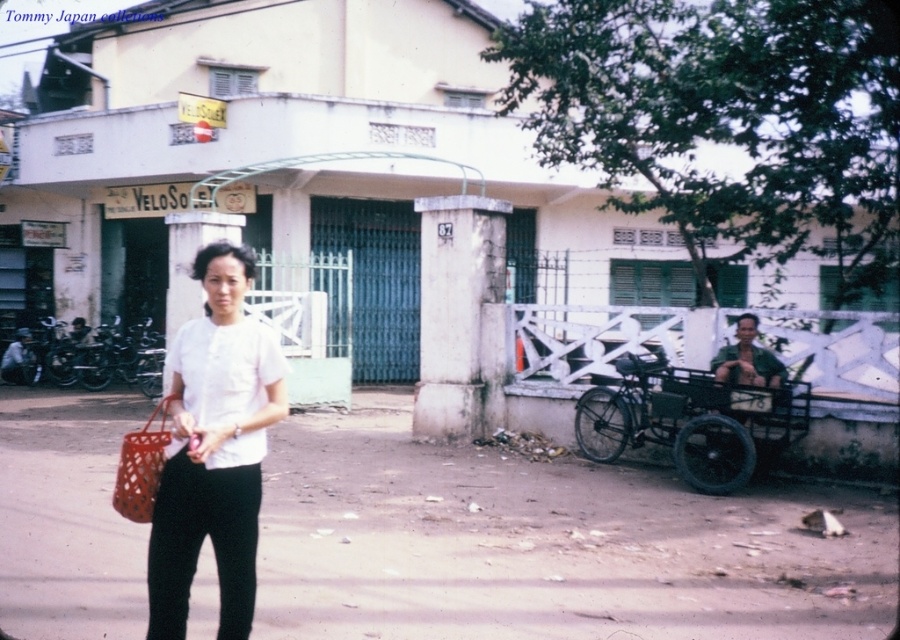
Question: Is brown dirt pavement at center to the left of black metal cart at right from the viewer's perspective?

Choices:
 (A) yes
 (B) no

Answer: (A)

Question: Which object is farther from the camera taking this photo?

Choices:
 (A) brown dirt pavement at center
 (B) white matte shirt at center

Answer: (A)

Question: Which point is closer to the camera?

Choices:
 (A) black metal cart at right
 (B) white matte shirt at center
 (C) brown dirt pavement at center

Answer: (B)

Question: Does brown dirt pavement at center appear under white matte shirt at center?

Choices:
 (A) yes
 (B) no

Answer: (A)

Question: Which is farther from the black metal cart at right?

Choices:
 (A) brown dirt pavement at center
 (B) white matte shirt at center

Answer: (B)

Question: Can you confirm if white matte shirt at center is positioned to the right of black metal cart at right?

Choices:
 (A) no
 (B) yes

Answer: (A)